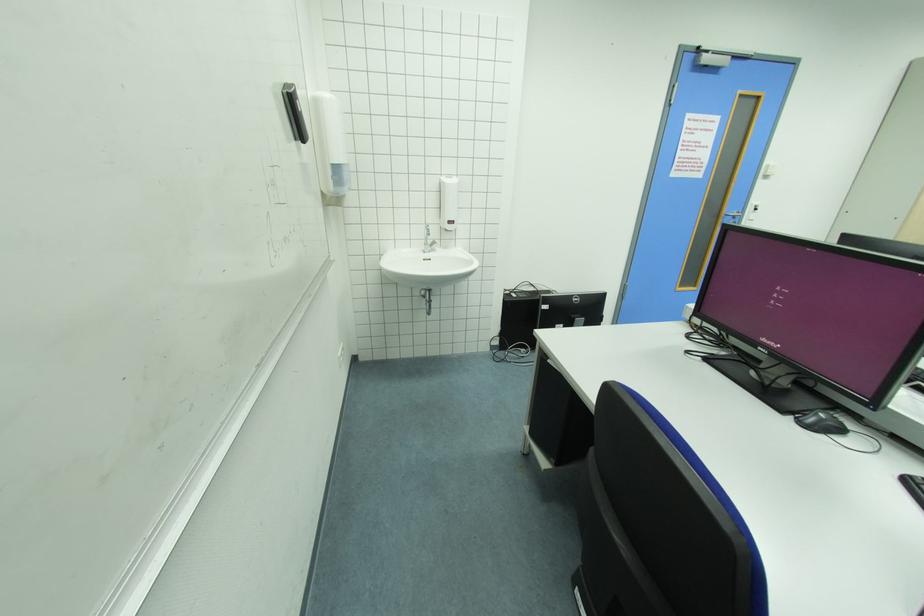
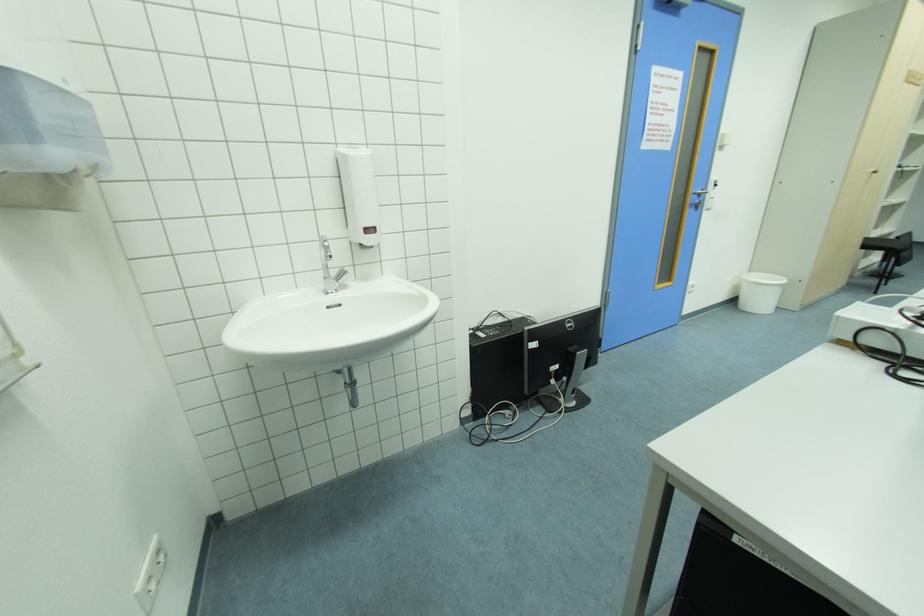
Find the pixel in the second image that matches [348,350] in the first image.

(164, 549)